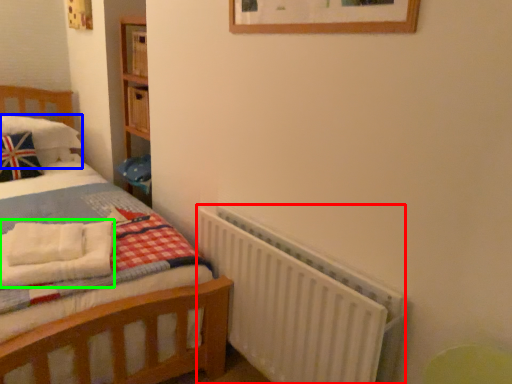
Question: Which object is positioned farthest from radiator (highlighted by a red box)? Select from pillow (highlighted by a blue box) and blanket (highlighted by a green box).

Choices:
 (A) pillow
 (B) blanket

Answer: (A)